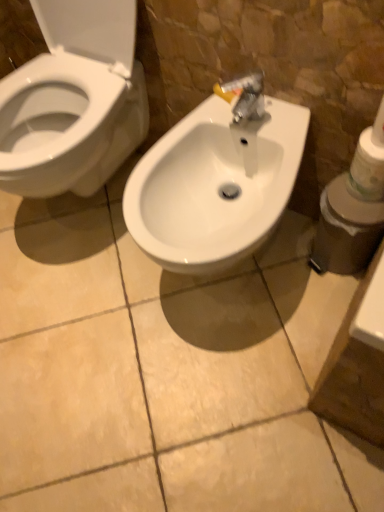
In order to click on vacant space in between white glossy sink at center and white plastic container at right in this screenshot , I will do `click(299, 297)`.